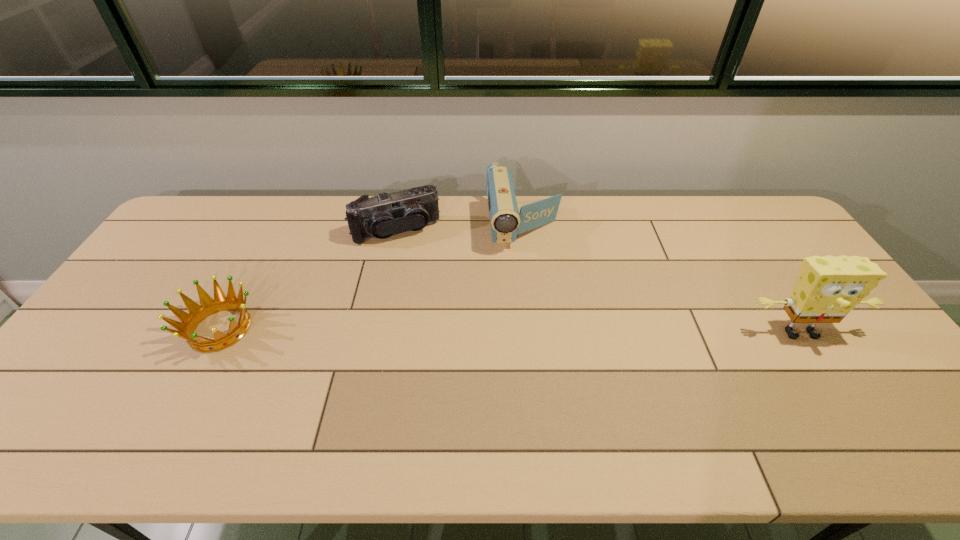
At what (x,y) coordinates should I click in order to perform the action: click on vacant space at the right edge of the desktop. Please return your answer as a coordinate pair (x, y). Looking at the image, I should click on (853, 372).

Locate an element on the screen. This screenshot has height=540, width=960. vacant space at the far right corner is located at coordinates click(x=755, y=224).

Locate an element on the screen. vacant area that lies between the right camcorder and the tallest object is located at coordinates (661, 280).

Identify the location of free spot between the sponge and the shortest object. This screenshot has width=960, height=540. (510, 330).

The height and width of the screenshot is (540, 960). Identify the location of free space that is in between the shorter camcorder and the right camcorder. (460, 229).

Where is `empty space that is in between the crown and the sponge`? empty space that is in between the crown and the sponge is located at coordinates (510, 330).

This screenshot has height=540, width=960. Find the location of `vacant region between the tallest object and the taller camcorder`. vacant region between the tallest object and the taller camcorder is located at coordinates pos(661,280).

The height and width of the screenshot is (540, 960). I want to click on empty space between the third shortest object and the shortest object, so click(372, 278).

Locate an element on the screen. The image size is (960, 540). vacant space in between the left camcorder and the right camcorder is located at coordinates (460, 229).

You are a GUI agent. You are given a task and a screenshot of the screen. Output one action in this format:
    pyautogui.click(x=<x>, y=<y>)
    Task: Click on the vacant space that is in between the sponge and the crown
    The height and width of the screenshot is (540, 960).
    Given the screenshot: What is the action you would take?
    pyautogui.click(x=510, y=330)